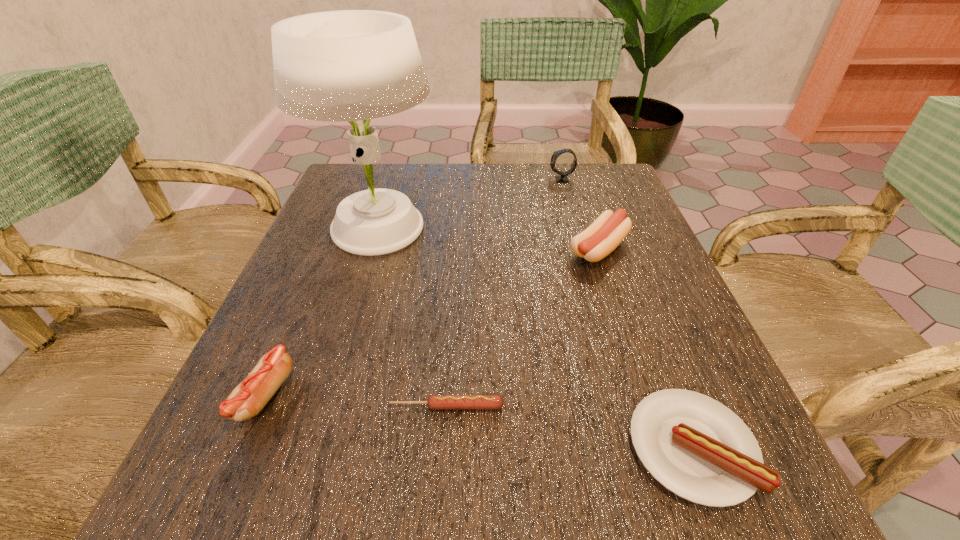
You are a GUI agent. You are given a task and a screenshot of the screen. Output one action in this format:
    pyautogui.click(x=<x>, y=<y>)
    Task: Click on the sausage located in the left edge section of the desktop
    
    Given the screenshot: What is the action you would take?
    pyautogui.click(x=246, y=400)

The width and height of the screenshot is (960, 540). What are the coordinates of `watch at the right edge` in the screenshot? It's located at (563, 176).

The image size is (960, 540). Identify the location of object that is positioned at the far left corner. (348, 65).

Find the location of a particular element. object at the far right corner is located at coordinates click(563, 176).

Locate an element on the screen. This screenshot has height=540, width=960. object that is positioned at the near right corner is located at coordinates (696, 447).

Find the location of a particular element. The image size is (960, 540). free space at the far edge of the desktop is located at coordinates (407, 178).

In the image, there is a desktop. What are the coordinates of `vacant space at the near edge` in the screenshot? It's located at (365, 468).

This screenshot has width=960, height=540. What are the coordinates of `vacant area at the left edge of the desktop` in the screenshot? It's located at coord(267,431).

In the image, there is a desktop. At what (x,y) coordinates should I click in order to perform the action: click on vacant space at the right edge. Please return your answer as a coordinate pair (x, y). This screenshot has width=960, height=540. Looking at the image, I should click on (665, 264).

You are a GUI agent. You are given a task and a screenshot of the screen. Output one action in this format:
    pyautogui.click(x=<x>, y=<y>)
    Task: Click on the vacant space at the far left corner of the desktop
    The height and width of the screenshot is (540, 960).
    Given the screenshot: What is the action you would take?
    pyautogui.click(x=398, y=167)